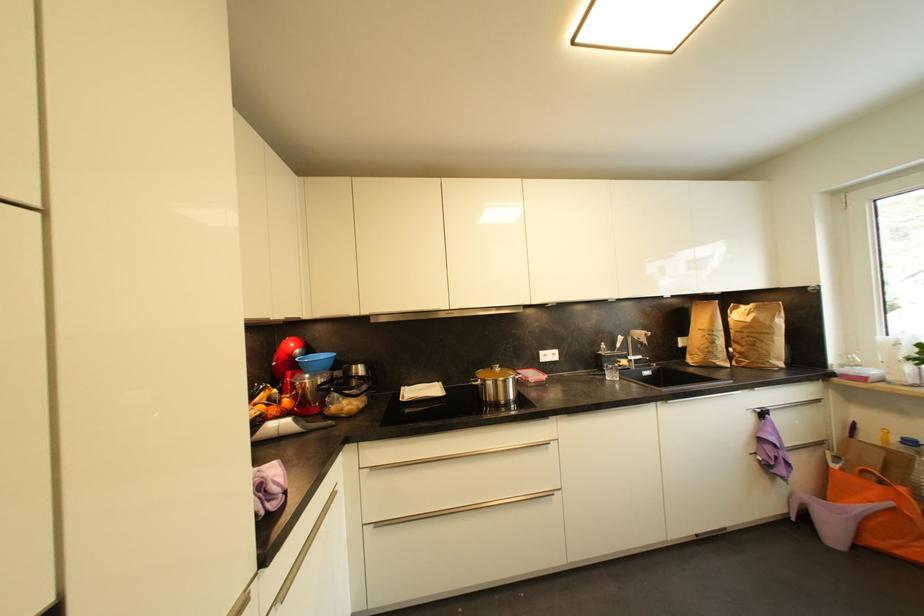
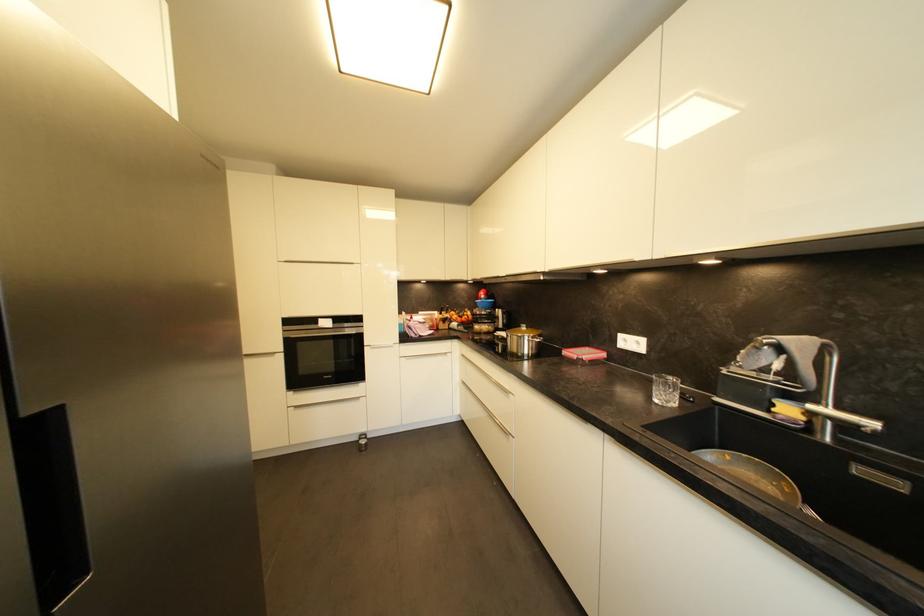
Question: I am providing you with two images of the same scene from different viewpoints. Which of the following objects are not visible in image2?

Choices:
 (A) refrigerator door handle
 (B) white power socket
 (C) cooking pot handle
 (D) none of these

Answer: (D)